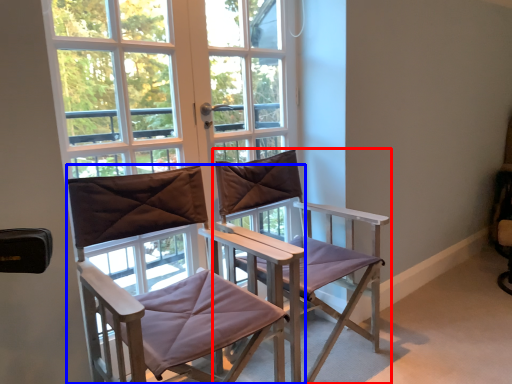
Question: Which object is further to the camera taking this photo, chair (highlighted by a red box) or chair (highlighted by a blue box)?

Choices:
 (A) chair
 (B) chair

Answer: (A)